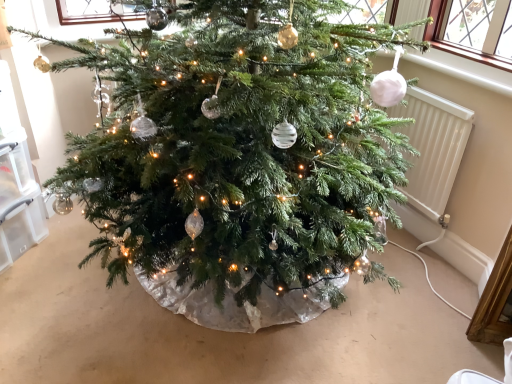
Locate an element on the screen. This screenshot has width=512, height=384. blank space situated above white ribbed radiator at right (from a real-world perspective) is located at coordinates (426, 87).